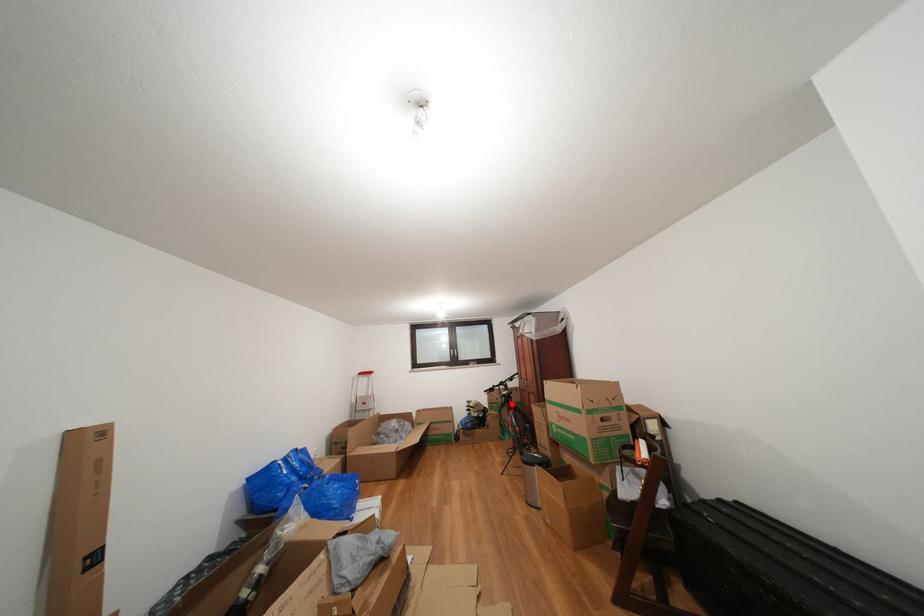
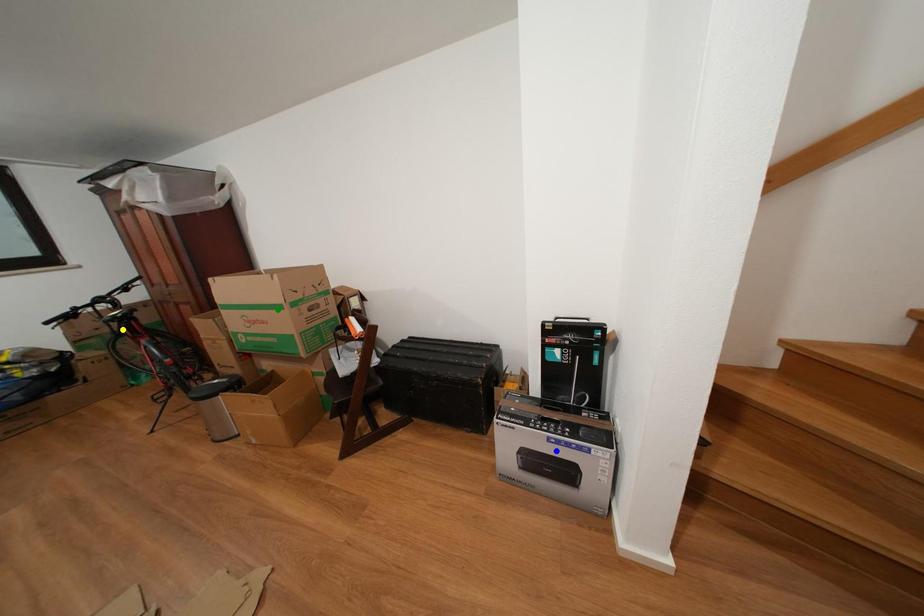
Question: I am providing you with two images of the same scene from different viewpoints. A red point is marked on the first image. You are given multiple points on the second image. Which point in image 2 represents the same 3d spot as the red point in image 1?

Choices:
 (A) blue point
 (B) yellow point
 (C) green point

Answer: (B)